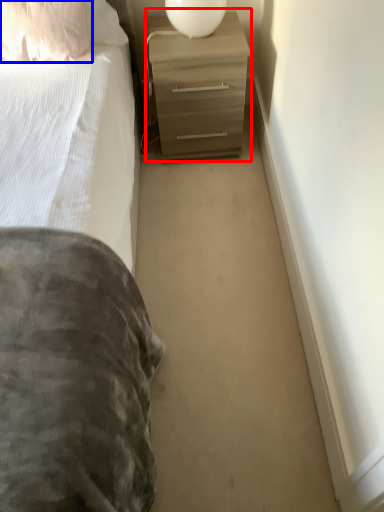
Question: Among these objects, which one is farthest to the camera, chest of drawers (highlighted by a red box) or pillow (highlighted by a blue box)?

Choices:
 (A) chest of drawers
 (B) pillow

Answer: (A)